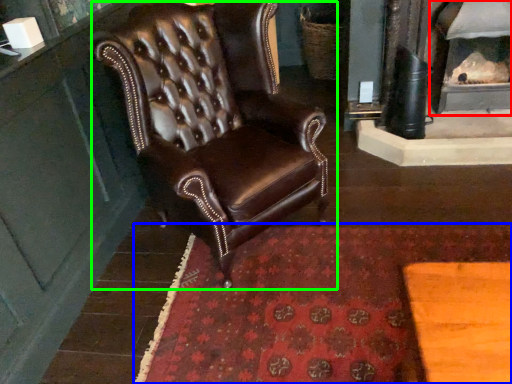
Question: Which object is the closest to the fireplace (highlighted by a red box)? Choose among these: mat (highlighted by a blue box) or chair (highlighted by a green box).

Choices:
 (A) mat
 (B) chair

Answer: (A)